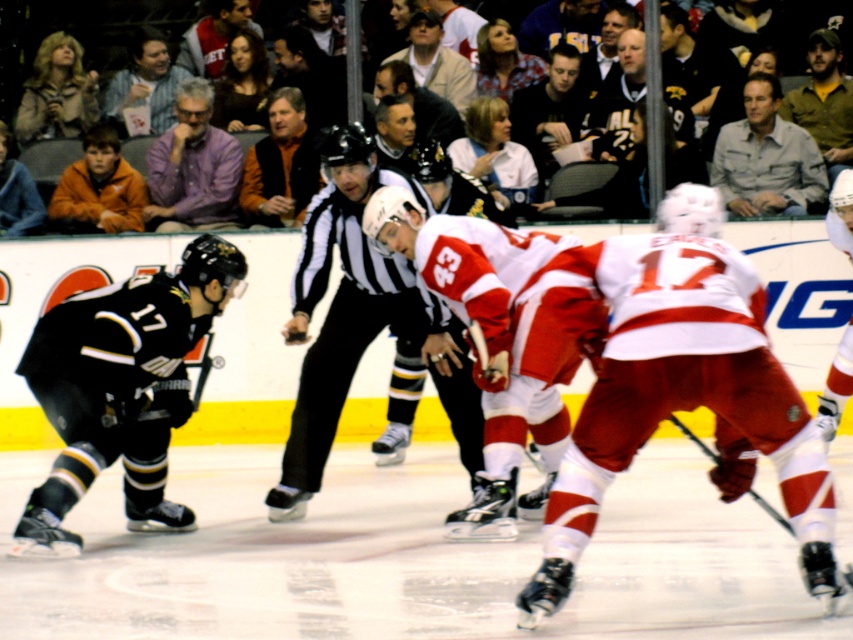
Which is in front, point (415, 65) or point (819, 403)?

Point (819, 403) is in front.

From the picture: Can you confirm if light brown leather jacket at upper center is positioned to the right of white matte jersey at center?

Incorrect, light brown leather jacket at upper center is not on the right side of white matte jersey at center.

Does point (422, 86) come closer to viewer compared to point (846, 216)?

That is False.

Image resolution: width=853 pixels, height=640 pixels. I want to click on light brown leather jacket at upper center, so click(436, 61).

Is white jersey at center behind dark brown leather jacket at upper center?

No.

This screenshot has height=640, width=853. Identify the location of white jersey at center. (683, 388).

Does point (695, 348) come closer to viewer compared to point (543, 154)?

Yes.

Locate an element on the screen. white jersey at center is located at coordinates (683, 388).

The width and height of the screenshot is (853, 640). What do you see at coordinates (144, 81) in the screenshot? I see `striped shirt at upper center` at bounding box center [144, 81].

In the scene shown: Can you confirm if striped shirt at upper center is wider than light brown leather jacket at upper center?

No.

Which is behind, point (161, 97) or point (416, 17)?

Point (416, 17)

This screenshot has width=853, height=640. Identify the location of striped shirt at upper center. (144, 81).